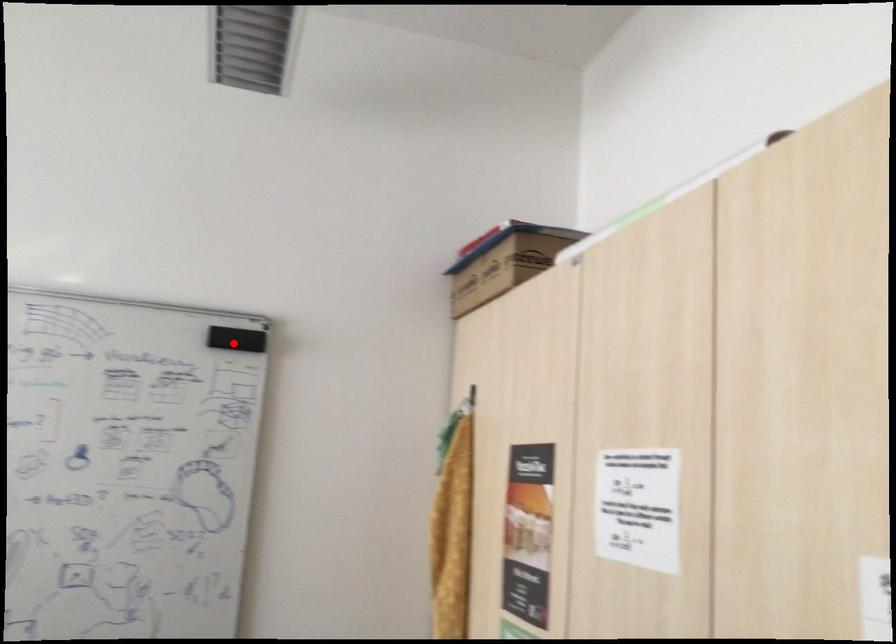
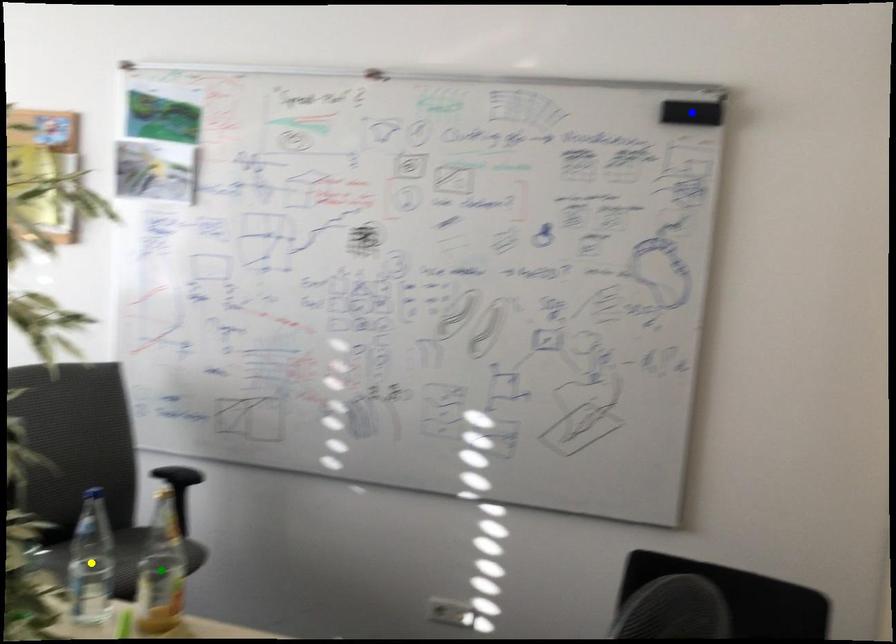
Question: I am providing you with two images of the same scene from different viewpoints. A red point is marked on the first image. You are given multiple points on the second image. Which spot in image 2 lines up with the point in image 1?

Choices:
 (A) green point
 (B) yellow point
 (C) blue point

Answer: (C)